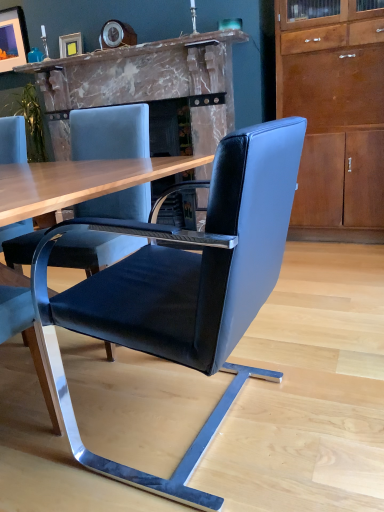
Question: Is black leather chair at center aimed at teal glass at upper center?

Choices:
 (A) yes
 (B) no

Answer: (B)

Question: Considering the relative sizes of black leather chair at center and teal glass at upper center in the image provided, is black leather chair at center taller than teal glass at upper center?

Choices:
 (A) yes
 (B) no

Answer: (A)

Question: Is black leather chair at center in contact with teal glass at upper center?

Choices:
 (A) no
 (B) yes

Answer: (A)

Question: From the image's perspective, is black leather chair at center on teal glass at upper center?

Choices:
 (A) yes
 (B) no

Answer: (B)

Question: From the image's perspective, does black leather chair at center appear lower than teal glass at upper center?

Choices:
 (A) yes
 (B) no

Answer: (A)

Question: Looking at their shapes, would you say black leather chair at center is wider or thinner than teal glass at upper center?

Choices:
 (A) wide
 (B) thin

Answer: (A)

Question: From a real-world perspective, is black leather chair at center physically located above or below teal glass at upper center?

Choices:
 (A) above
 (B) below

Answer: (B)

Question: In terms of height, does black leather chair at center look taller or shorter compared to teal glass at upper center?

Choices:
 (A) tall
 (B) short

Answer: (A)

Question: Which is correct: black leather chair at center is inside teal glass at upper center, or outside of it?

Choices:
 (A) outside
 (B) inside

Answer: (A)

Question: Considering the relative positions of matte gold picture frame at upper center, acting as the first picture frame starting from the right, and marble fireplace at center in the image provided, is matte gold picture frame at upper center, acting as the first picture frame starting from the right, to the left or to the right of marble fireplace at center?

Choices:
 (A) left
 (B) right

Answer: (A)

Question: Is matte gold picture frame at upper center, acting as the first picture frame starting from the right, in front of or behind marble fireplace at center in the image?

Choices:
 (A) front
 (B) behind

Answer: (B)

Question: Considering the positions of matte gold picture frame at upper center, placed as the 1th picture frame when sorted from bottom to top, and marble fireplace at center in the image, is matte gold picture frame at upper center, placed as the 1th picture frame when sorted from bottom to top, wider or thinner than marble fireplace at center?

Choices:
 (A) wide
 (B) thin

Answer: (B)

Question: Based on their sizes in the image, would you say matte gold picture frame at upper center, which is the second picture frame from back to front, is bigger or smaller than marble fireplace at center?

Choices:
 (A) big
 (B) small

Answer: (B)

Question: Does point (279, 231) appear closer or farther from the camera than point (104, 57)?

Choices:
 (A) closer
 (B) farther

Answer: (A)

Question: In terms of size, does black leather chair at center appear bigger or smaller than marble fireplace at center?

Choices:
 (A) big
 (B) small

Answer: (B)